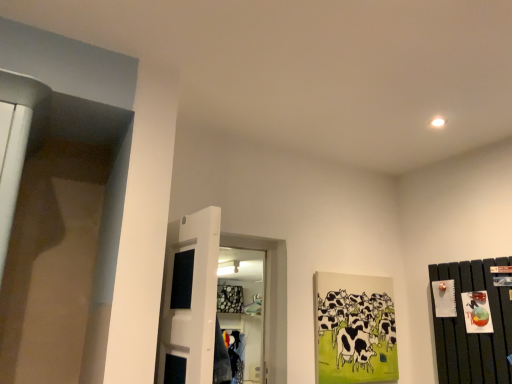
Question: Would you consider white glossy door at center to be distant from dark wood dresser at right?

Choices:
 (A) yes
 (B) no

Answer: (A)

Question: Is white glossy door at center facing away from dark wood dresser at right?

Choices:
 (A) yes
 (B) no

Answer: (B)

Question: Can you confirm if white glossy door at center is shorter than dark wood dresser at right?

Choices:
 (A) no
 (B) yes

Answer: (B)

Question: Is white glossy door at center thinner than dark wood dresser at right?

Choices:
 (A) no
 (B) yes

Answer: (A)

Question: Is white glossy door at center behind dark wood dresser at right?

Choices:
 (A) no
 (B) yes

Answer: (A)

Question: Which is correct: white glossy door at center is inside dark wood dresser at right, or outside of it?

Choices:
 (A) inside
 (B) outside

Answer: (B)

Question: Is white glossy door at center in front of or behind dark wood dresser at right in the image?

Choices:
 (A) front
 (B) behind

Answer: (A)

Question: From the image's perspective, relative to dark wood dresser at right, is white glossy door at center above or below?

Choices:
 (A) below
 (B) above

Answer: (B)

Question: From a real-world perspective, relative to dark wood dresser at right, is white glossy door at center vertically above or below?

Choices:
 (A) below
 (B) above

Answer: (B)

Question: From the image's perspective, is dark wood dresser at right positioned above or below white glossy door at center?

Choices:
 (A) above
 (B) below

Answer: (B)

Question: Is dark wood dresser at right bigger or smaller than white glossy door at center?

Choices:
 (A) small
 (B) big

Answer: (A)

Question: Is dark wood dresser at right wider or thinner than white glossy door at center?

Choices:
 (A) wide
 (B) thin

Answer: (B)

Question: Based on their positions, is dark wood dresser at right located to the left or right of white glossy door at center?

Choices:
 (A) left
 (B) right

Answer: (B)

Question: Considering the positions of black and white painted cows at center right and white glossy door at center in the image, is black and white painted cows at center right taller or shorter than white glossy door at center?

Choices:
 (A) short
 (B) tall

Answer: (A)

Question: Would you say black and white painted cows at center right is to the left or to the right of white glossy door at center in the picture?

Choices:
 (A) left
 (B) right

Answer: (B)